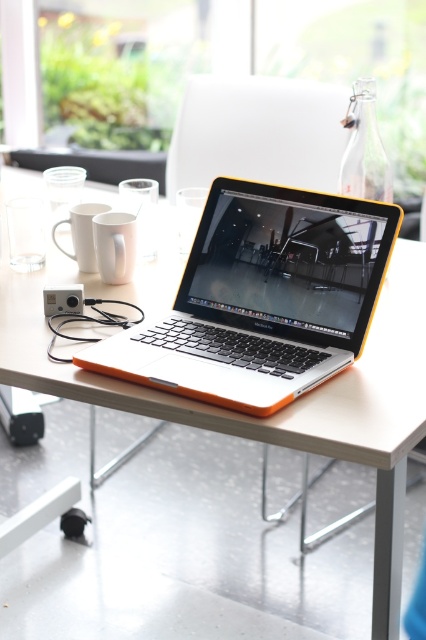
Question: Which is farther from the white matte table at center?

Choices:
 (A) orange plastic laptop at center
 (B) white matte mug at upper left

Answer: (B)

Question: Is white matte table at center bigger than white matte mug at upper left?

Choices:
 (A) yes
 (B) no

Answer: (A)

Question: Is white matte table at center positioned in front of orange plastic laptop at center?

Choices:
 (A) no
 (B) yes

Answer: (B)

Question: Which object appears farthest from the camera in this image?

Choices:
 (A) white matte mug at upper left
 (B) orange plastic laptop at center

Answer: (A)

Question: Which is nearer to the white matte table at center?

Choices:
 (A) orange plastic laptop at center
 (B) white matte mug at upper left

Answer: (A)

Question: Can you confirm if white matte table at center is wider than orange plastic laptop at center?

Choices:
 (A) no
 (B) yes

Answer: (B)